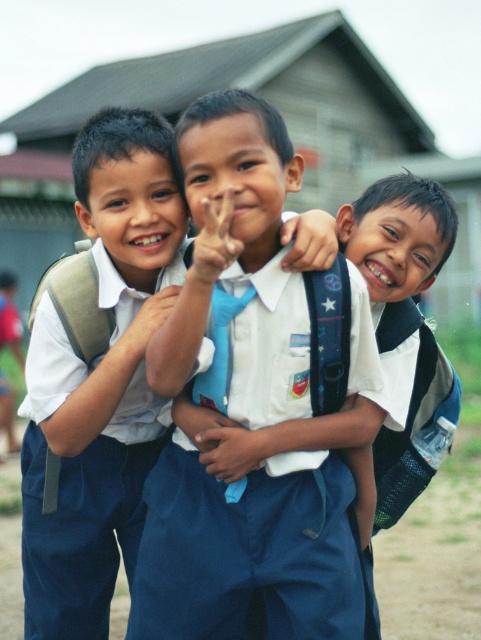
Between white uniform shirt at center and white matte uniform at left, which one is positioned lower?

white matte uniform at left is below.

Which of these two, white uniform shirt at center or white matte uniform at left, stands shorter?

With less height is white uniform shirt at center.

Image resolution: width=481 pixels, height=640 pixels. What are the coordinates of `white uniform shirt at center` in the screenshot? It's located at tap(248, 545).

Locate an element on the screen. The width and height of the screenshot is (481, 640). white uniform shirt at center is located at coordinates (248, 545).

Can you confirm if white uniform shirt at center is positioned below white fabric shirt at center?

No.

Can you confirm if white uniform shirt at center is thinner than white fabric shirt at center?

Incorrect, white uniform shirt at center's width is not less than white fabric shirt at center's.

Locate an element on the screen. The image size is (481, 640). white uniform shirt at center is located at coordinates (248, 545).

Is white matte uniform at left thinner than white fabric shirt at center?

No.

The image size is (481, 640). Describe the element at coordinates (100, 381) in the screenshot. I see `white matte uniform at left` at that location.

This screenshot has width=481, height=640. Find the location of `white matte uniform at left`. white matte uniform at left is located at coordinates (100, 381).